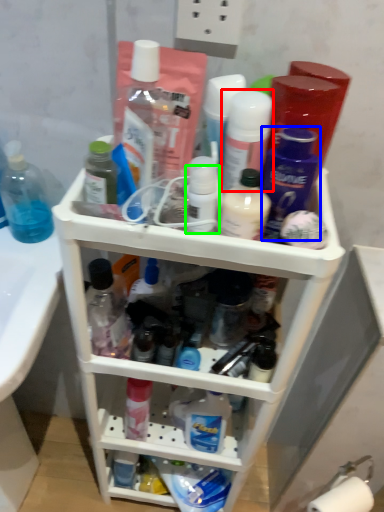
Question: Which object is positioned closest to toiletry (highlighted by a red box)? Select from toiletry (highlighted by a blue box) and toiletry (highlighted by a green box).

Choices:
 (A) toiletry
 (B) toiletry

Answer: (A)